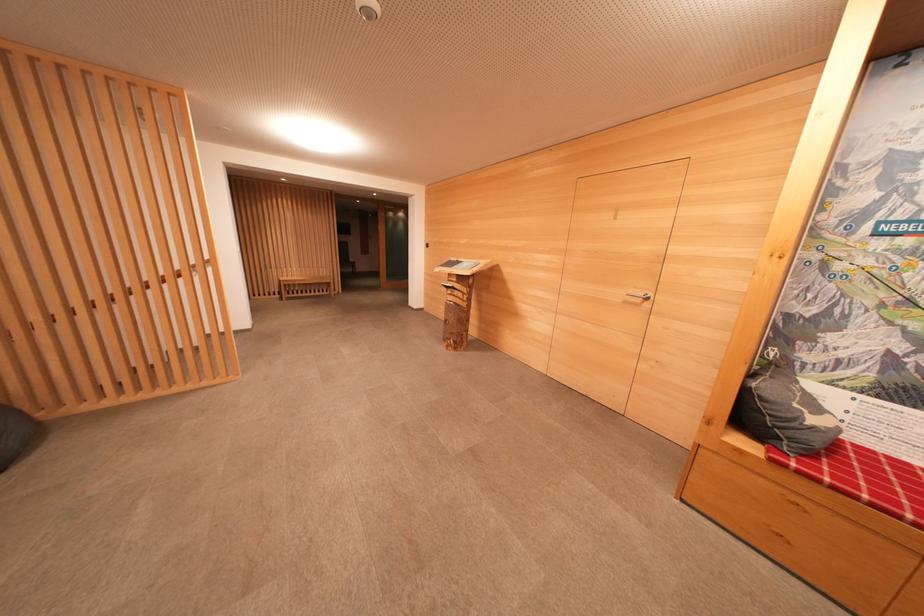
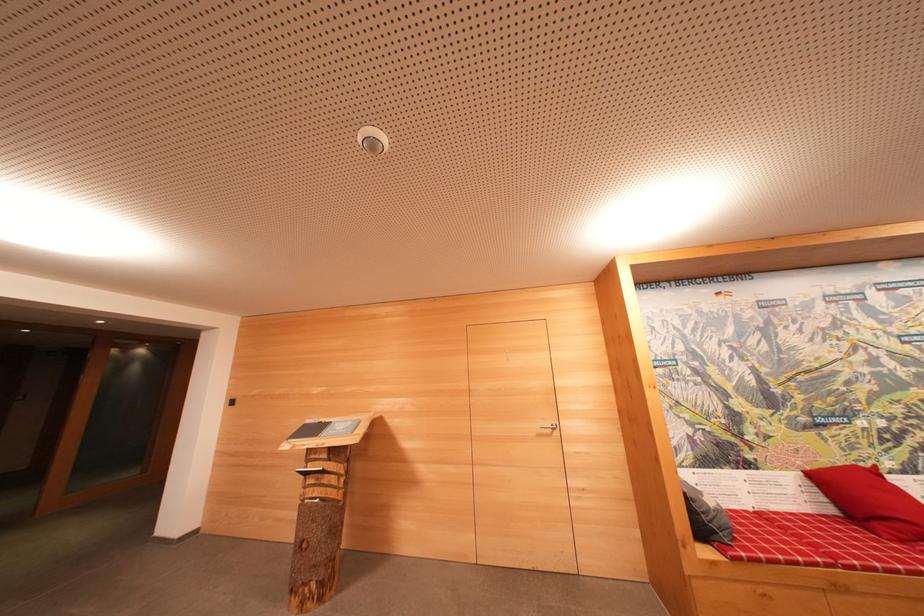
In the second image, find the point that corresponds to the point at 456,262 in the first image.

(311, 424)